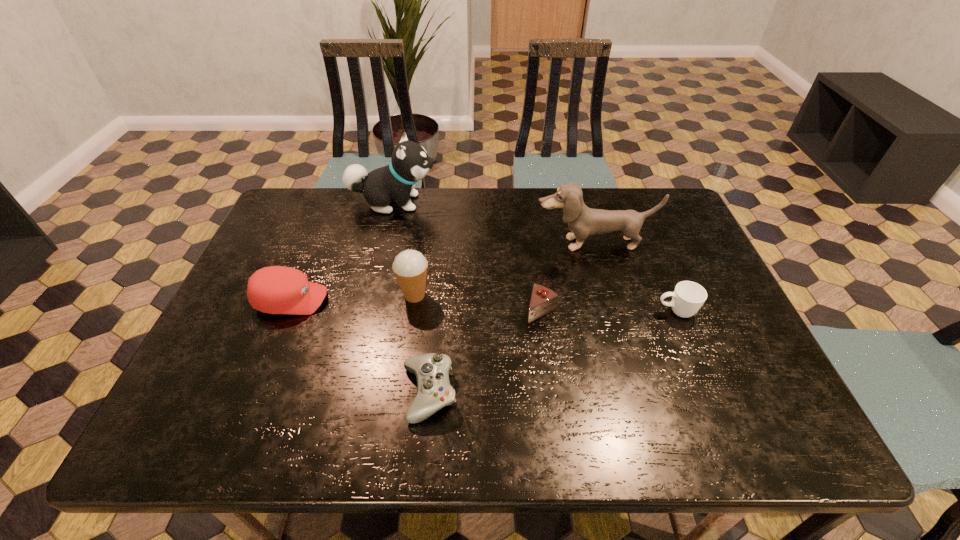
At what (x,y) coordinates should I click in order to perform the action: click on free space between the third tallest object and the right puppy. Please return your answer as a coordinate pair (x, y). Looking at the image, I should click on (504, 269).

The width and height of the screenshot is (960, 540). Identify the location of empty space between the cap and the cup. (484, 306).

Where is `free space that is in between the cap and the nearest object`? This screenshot has width=960, height=540. free space that is in between the cap and the nearest object is located at coordinates (360, 346).

You are a GUI agent. You are given a task and a screenshot of the screen. Output one action in this format:
    pyautogui.click(x=<x>, y=<y>)
    Task: Click on the free space between the chocolate cake and the nearest object
    The height and width of the screenshot is (540, 960).
    Given the screenshot: What is the action you would take?
    pyautogui.click(x=485, y=352)

Locate an element on the screen. The image size is (960, 540). blank region between the nearest object and the cup is located at coordinates tap(553, 352).

You are a GUI agent. You are given a task and a screenshot of the screen. Output one action in this format:
    pyautogui.click(x=<x>, y=<y>)
    Task: Click on the vacant point located between the third tallest object and the left puppy
    The image size is (960, 540).
    Given the screenshot: What is the action you would take?
    pyautogui.click(x=404, y=249)

Where is `vacant area that lies between the chocolate cake and the nearest object`? The width and height of the screenshot is (960, 540). vacant area that lies between the chocolate cake and the nearest object is located at coordinates (485, 352).

Locate an element on the screen. This screenshot has height=540, width=960. vacant space that's between the right puppy and the control is located at coordinates (511, 318).

This screenshot has height=540, width=960. I want to click on object that stands as the third closest to the left puppy, so click(x=583, y=221).

This screenshot has width=960, height=540. I want to click on the closest object to the farthest object, so click(x=275, y=289).